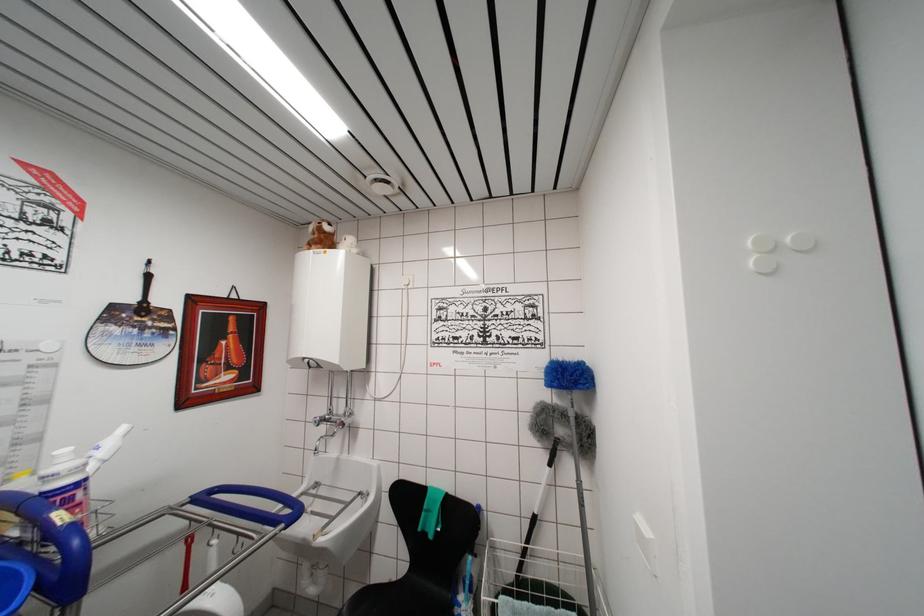
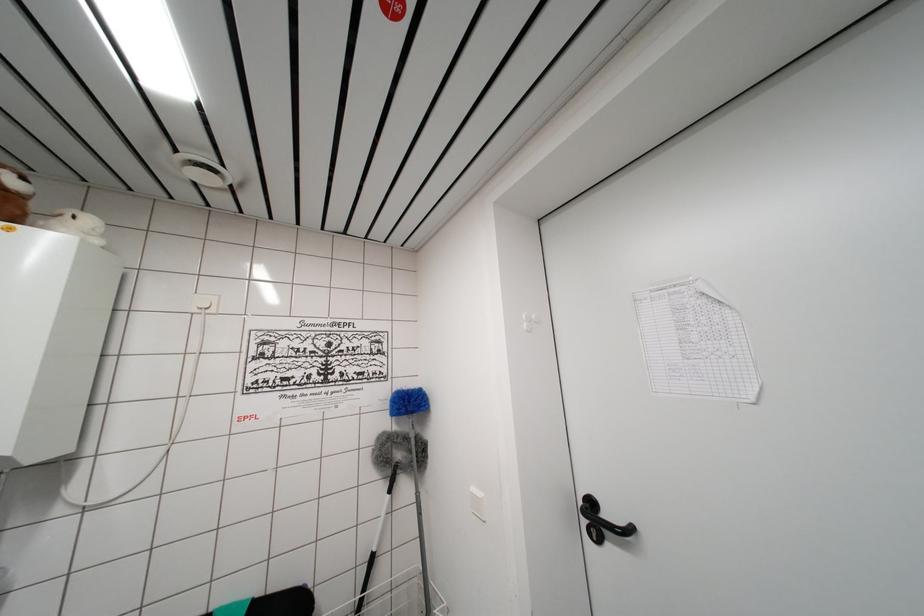
Question: Based on the continuous images, in which direction is the camera rotating? Reply with the corresponding letter.

Choices:
 (A) Left
 (B) Right
 (C) Up
 (D) Down

Answer: (B)